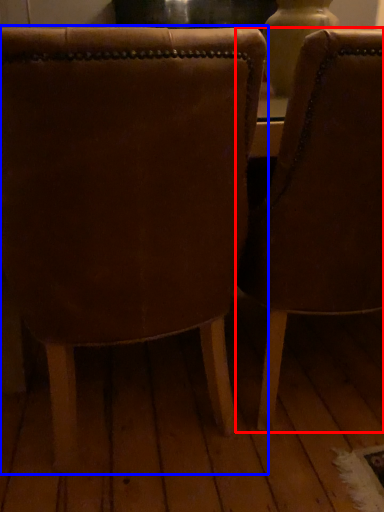
Question: Which of the following is the farthest to the observer, chair (highlighted by a red box) or chair (highlighted by a blue box)?

Choices:
 (A) chair
 (B) chair

Answer: (A)